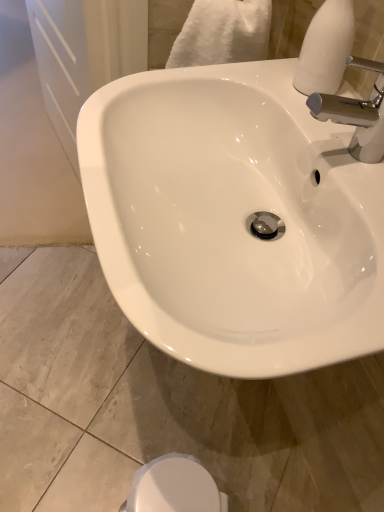
Find the location of a particular element. free location in front of white matte soap dispenser at upper right is located at coordinates (327, 130).